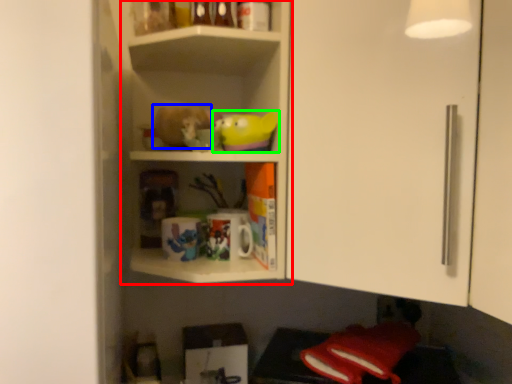
Question: Considering the real-world distances, which object is closest to shelf (highlighted by a red box)? stuff (highlighted by a blue box) or toy (highlighted by a green box).

Choices:
 (A) stuff
 (B) toy

Answer: (A)